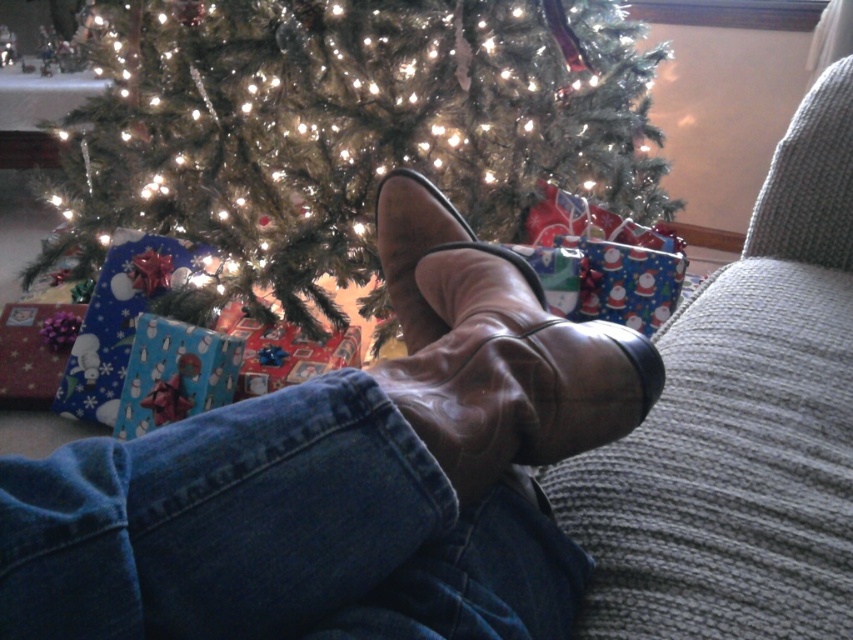
You are sitting on a couch and see the leather shoe at lower center and the green matte christmas tree at center. Which object is positioned to the right of the other?

The leather shoe at lower center is to the right of the green matte christmas tree at center.

You are sitting on a couch and want to place a small gift under the Christmas tree. The gift is 10 cm wide. The space between the leather shoe at lower center and the edge of the couch is 15 cm. Can you fit the gift there?

The space between the leather shoe at lower center and the edge of the couch is 15 cm, which is wider than the gift of 10 cm. Therefore, the gift can be placed there.

You are sitting on a couch in front of the Christmas tree and want to reach the point at coordinates point (x=462, y=582) where you dropped your phone. Can you comfortably stretch your hand to that point without getting off the couch?

The distance between you and point (x=462, y=582) is 15.23 inches. Since the average arm length is about 25 inches, you can comfortably reach it without leaving the couch.